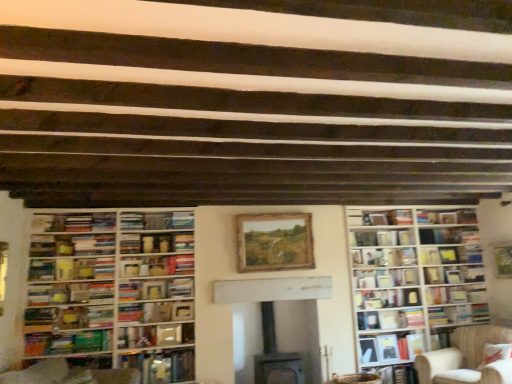
At what (x,y) coordinates should I click in order to perform the action: click on blank space above wooden-framed painting at center, which appears as the first picture frame when viewed from the left (from a real-world perspective). Please return your answer as a coordinate pair (x, y). Looking at the image, I should click on (274, 214).